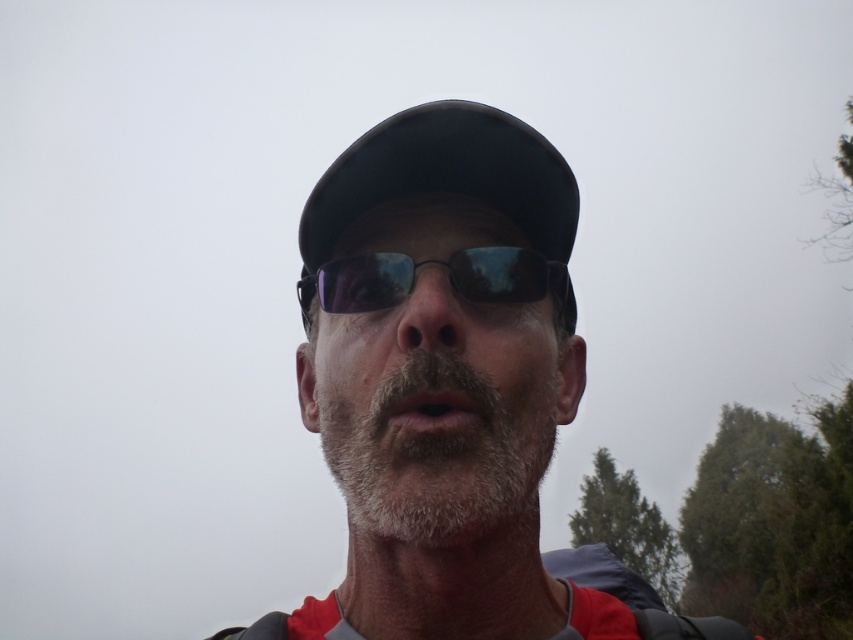
Question: Is matte black cap at center thinner than black matte baseball hat at center?

Choices:
 (A) yes
 (B) no

Answer: (B)

Question: Which point appears closest to the camera in this image?

Choices:
 (A) (347, 305)
 (B) (415, 248)
 (C) (473, 157)
 (D) (469, 538)

Answer: (D)

Question: Which object appears closest to the camera in this image?

Choices:
 (A) black reflective sunglasses at center
 (B) graywoollybeard at center

Answer: (B)

Question: Estimate the real-world distances between objects in this image. Which object is closer to the graywoollybeard at center?

Choices:
 (A) black matte baseball hat at center
 (B) matte black cap at center
 (C) black reflective sunglasses at center

Answer: (B)

Question: Where is matte black cap at center located in relation to black reflective sunglasses at center in the image?

Choices:
 (A) below
 (B) above

Answer: (A)

Question: In this image, where is graywoollybeard at center located relative to black matte baseball hat at center?

Choices:
 (A) left
 (B) right

Answer: (B)